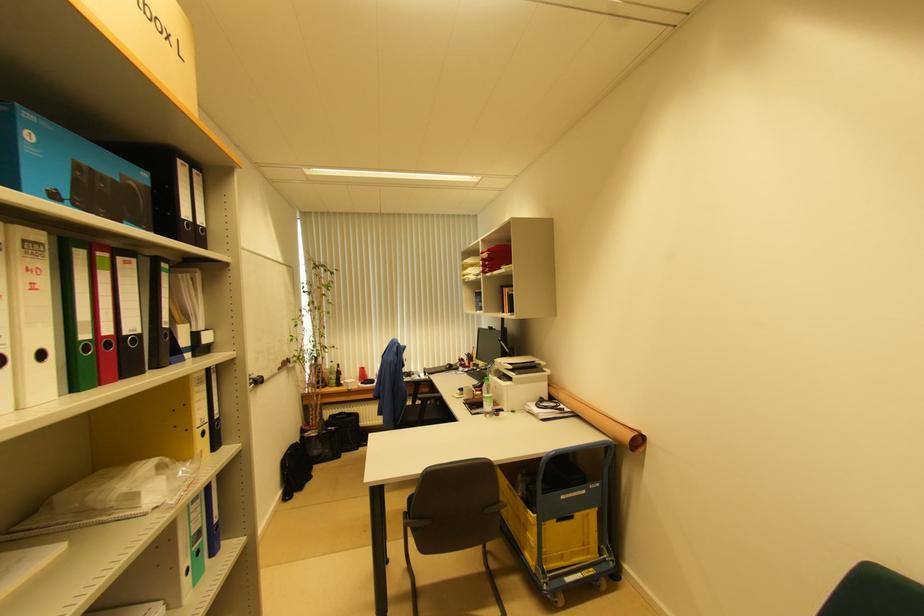
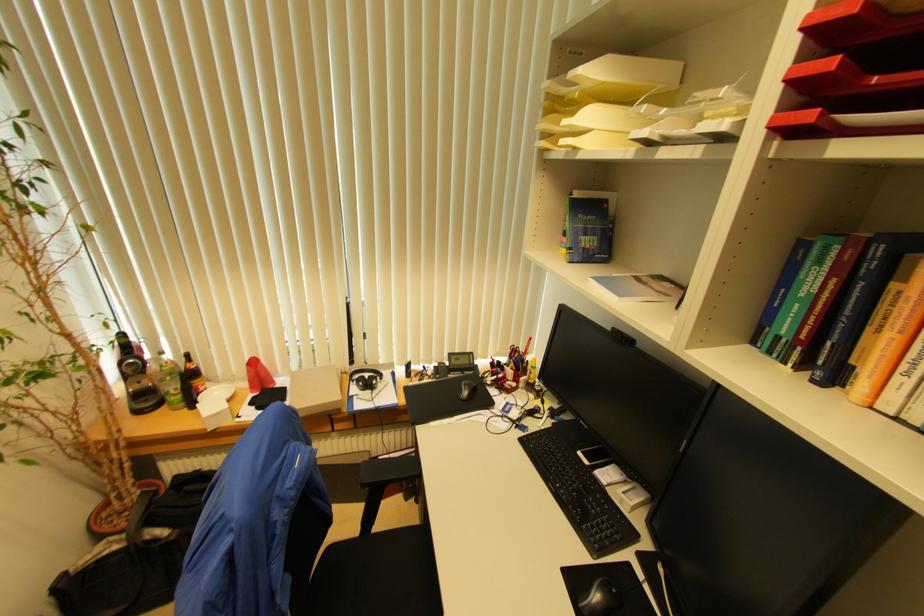
The point at [339,368] is marked in the first image. Where is the corresponding point in the second image?

(188, 358)